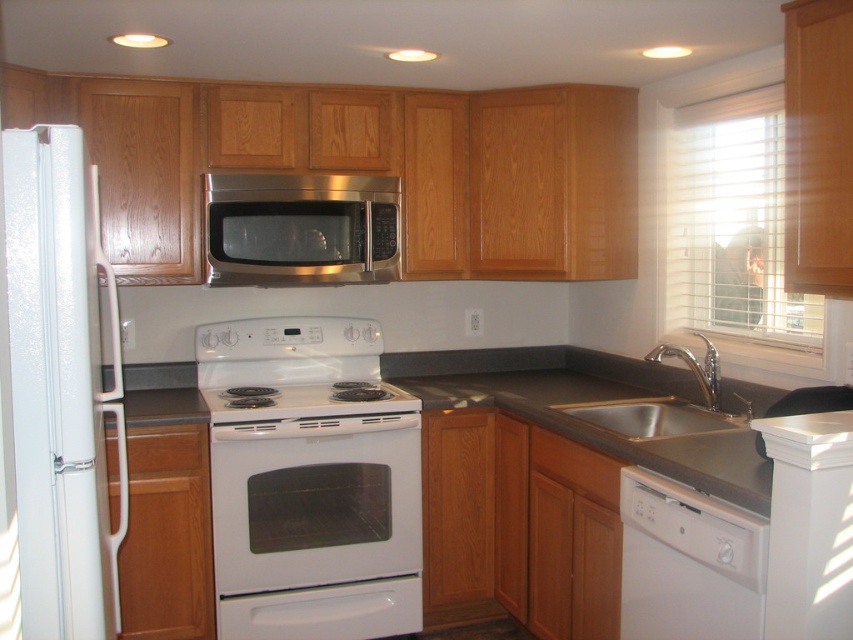
Question: Among these objects, which one is nearest to the camera?

Choices:
 (A) white glossy refrigerator at left
 (B) white glossy stove at center

Answer: (A)

Question: Considering the relative positions of white glossy oven at center and white glossy stove at center in the image provided, where is white glossy oven at center located with respect to white glossy stove at center?

Choices:
 (A) below
 (B) above

Answer: (A)

Question: Which object is the farthest from the silver metallic sink at lower right?

Choices:
 (A) white glossy stove at center
 (B) white glossy oven at center

Answer: (B)

Question: Can you confirm if stainless steel microwave at center is wider than white glossy stove at center?

Choices:
 (A) no
 (B) yes

Answer: (A)

Question: Does white glossy dishwasher at lower right have a lesser width compared to stainless steel microwave at center?

Choices:
 (A) yes
 (B) no

Answer: (A)

Question: Which of the following is the closest to the observer?

Choices:
 (A) (276, 240)
 (B) (686, 518)

Answer: (B)